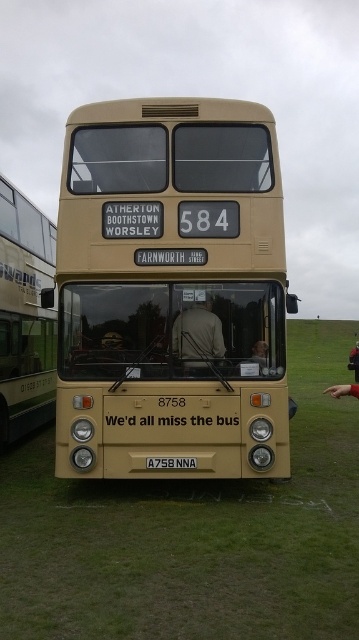
You are standing on the green grass at center and want to walk to the beige matte bus at left. Which direction should you face to walk directly towards the bus?

Since the green grass at center is to the right of the beige matte bus at left, you should face left to walk directly towards the beige matte bus at left.